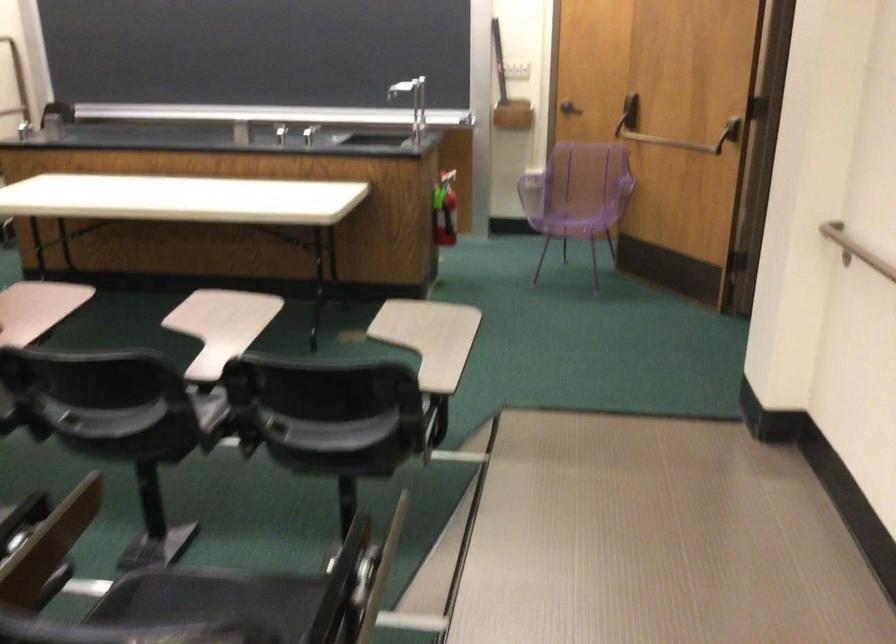
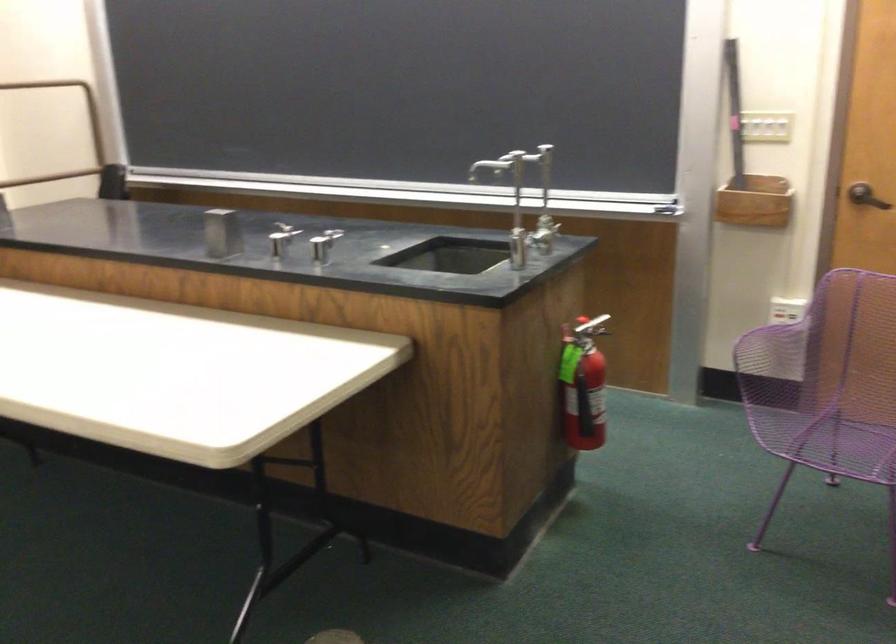
Question: In a continuous first-person perspective shot, in which direction is the camera moving?

Choices:
 (A) Left
 (B) Right
 (C) Forward
 (D) Backward

Answer: (C)